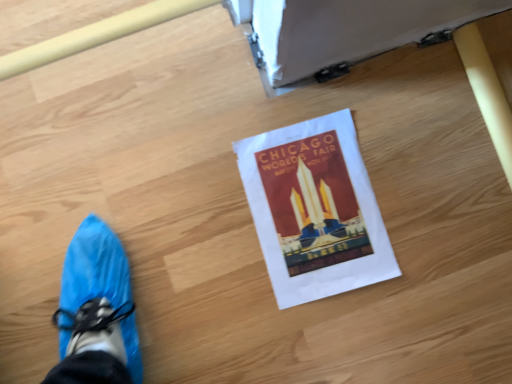
Describe the element at coordinates (315, 210) in the screenshot. I see `matte paper poster at center` at that location.

Find the location of a particular element. matte paper poster at center is located at coordinates (315, 210).

Identify the location of matte paper poster at center. (315, 210).